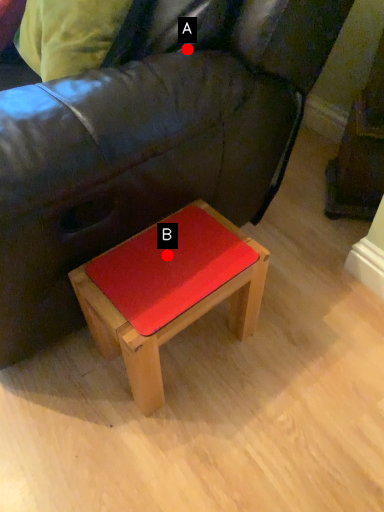
Question: Two points are circled on the image, labeled by A and B beside each circle. Among these points, which one is nearest to the camera?

Choices:
 (A) A is closer
 (B) B is closer

Answer: (A)